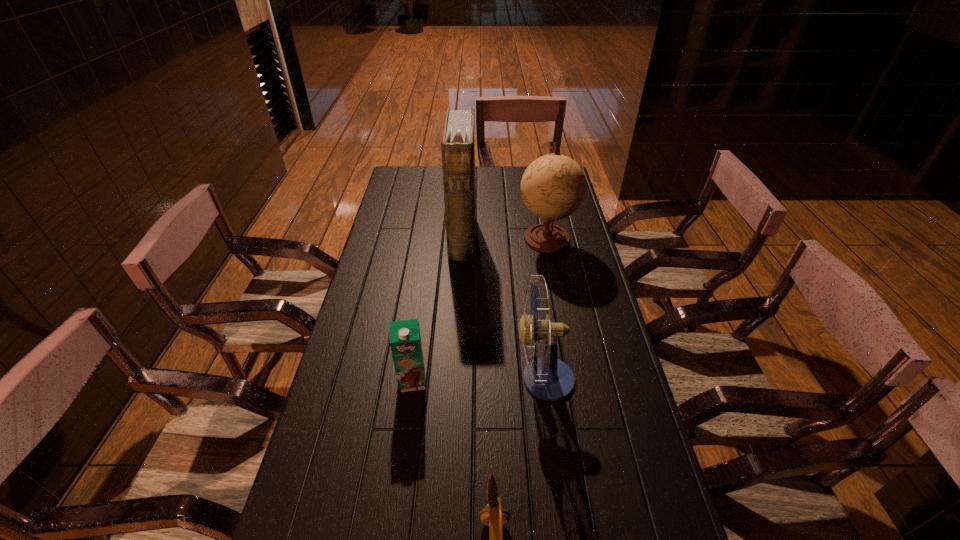
Where is `vacant point located between the phonebook and the fan`? This screenshot has width=960, height=540. vacant point located between the phonebook and the fan is located at coordinates (503, 309).

This screenshot has width=960, height=540. Identify the location of free space that is in between the fan and the carton. (478, 380).

Find the location of a particular element. The height and width of the screenshot is (540, 960). vacant area that lies between the carton and the fan is located at coordinates (478, 380).

Identify the location of object that is the nearest to the globe. The image size is (960, 540). (458, 141).

I want to click on object that can be found as the fourth closest to the fourth object from right to left, so click(493, 515).

You are a GUI agent. You are given a task and a screenshot of the screen. Output one action in this format:
    pyautogui.click(x=<x>, y=<y>)
    Task: Click on the free space that satisfies the following two spatial constraints: 1. on the surface of the globe; 2. at the front of the fan where the blades are visible
    
    Given the screenshot: What is the action you would take?
    pyautogui.click(x=573, y=379)